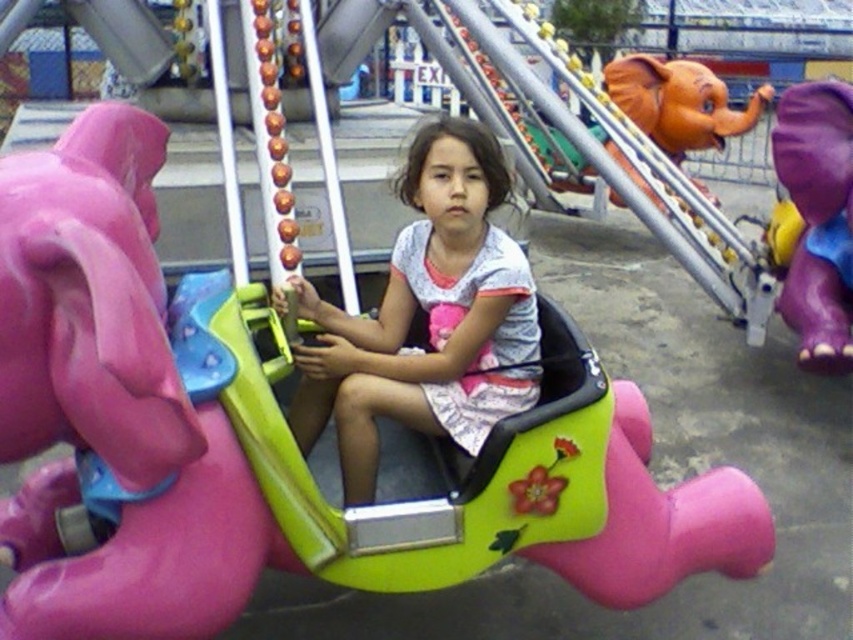
You are a parent trying to locate your child who is sitting on the purple matte elephant at right. You see the orange matte elephant head at upper right in the distance. Which elephant is lower in position?

The purple matte elephant at right is located below the orange matte elephant head at upper right, so it is lower in position.